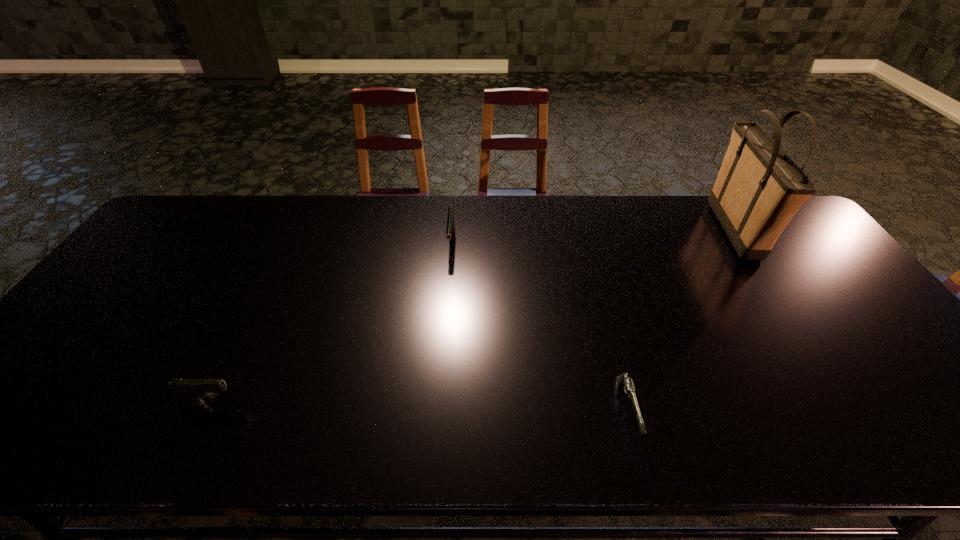
Where is `the rightmost object`? the rightmost object is located at coordinates (759, 188).

You are a GUI agent. You are given a task and a screenshot of the screen. Output one action in this format:
    pyautogui.click(x=<x>, y=<y>)
    Task: Click on the tallest object
    This screenshot has height=540, width=960.
    Given the screenshot: What is the action you would take?
    pyautogui.click(x=759, y=188)

The width and height of the screenshot is (960, 540). I want to click on the second pistol from right to left, so click(x=450, y=229).

The height and width of the screenshot is (540, 960). I want to click on the farthest pistol, so click(450, 229).

What are the coordinates of `the leftmost pistol` in the screenshot? It's located at (190, 391).

Locate an element on the screen. Image resolution: width=960 pixels, height=540 pixels. the rightmost pistol is located at coordinates (625, 380).

Where is `the shortest pistol`? The height and width of the screenshot is (540, 960). the shortest pistol is located at coordinates (625, 380).

The width and height of the screenshot is (960, 540). Identify the location of free space located 0.090m on the left of the rightmost object. (688, 231).

Identify the location of free space located 0.220m at the muzzle of the farthest pistol. point(446,313).

Identify the location of free spot located at the barrel of the leftmost pistol. Image resolution: width=960 pixels, height=540 pixels. (281, 403).